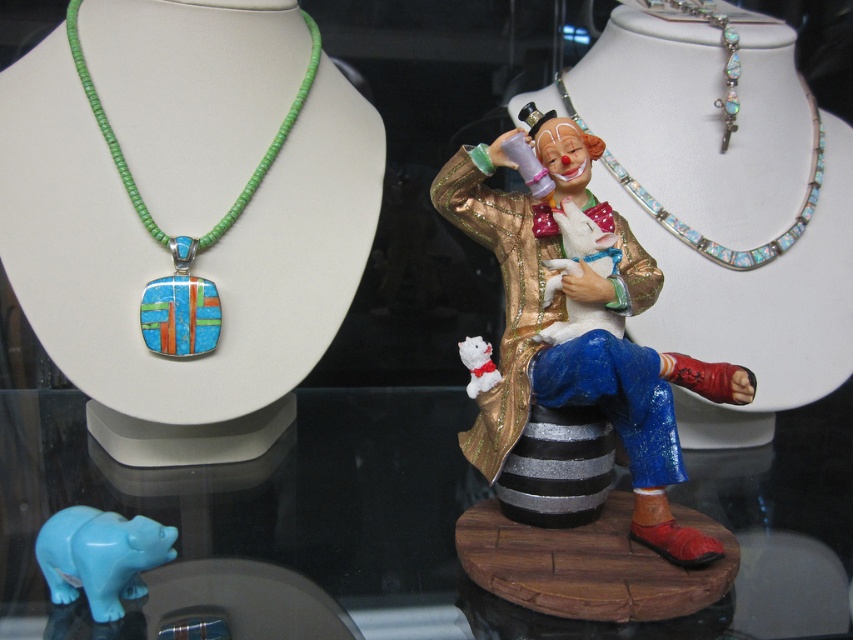
Can you confirm if multicolored inlay pendant at left is positioned below turquoise glossy bear at lower left?

No.

Between point (212, 240) and point (161, 560), which one is positioned in front?

Point (161, 560) is more forward.

Which is behind, point (242, 188) or point (140, 540)?

The point (242, 188) is more distant.

Where is `multicolored inlay pendant at left`? multicolored inlay pendant at left is located at coordinates (184, 236).

Can you confirm if shiny gold clown at center is positioned above opaline glass necklace at upper right?

No.

Between point (720, 378) and point (796, 221), which one is positioned behind?

The point (796, 221) is more distant.

The height and width of the screenshot is (640, 853). What do you see at coordinates (581, 333) in the screenshot?
I see `shiny gold clown at center` at bounding box center [581, 333].

This screenshot has width=853, height=640. Identify the location of shiny gold clown at center. (581, 333).

Can you confirm if multicolored inlay pendant at left is bigger than white plush toy at center?

Indeed, multicolored inlay pendant at left has a larger size compared to white plush toy at center.

In order to click on multicolored inlay pendant at left in this screenshot , I will do `click(184, 236)`.

Between point (194, 280) and point (471, 397), which one is positioned in front?

Point (471, 397) is in front.

The height and width of the screenshot is (640, 853). What are the coordinates of `multicolored inlay pendant at left` in the screenshot? It's located at (184, 236).